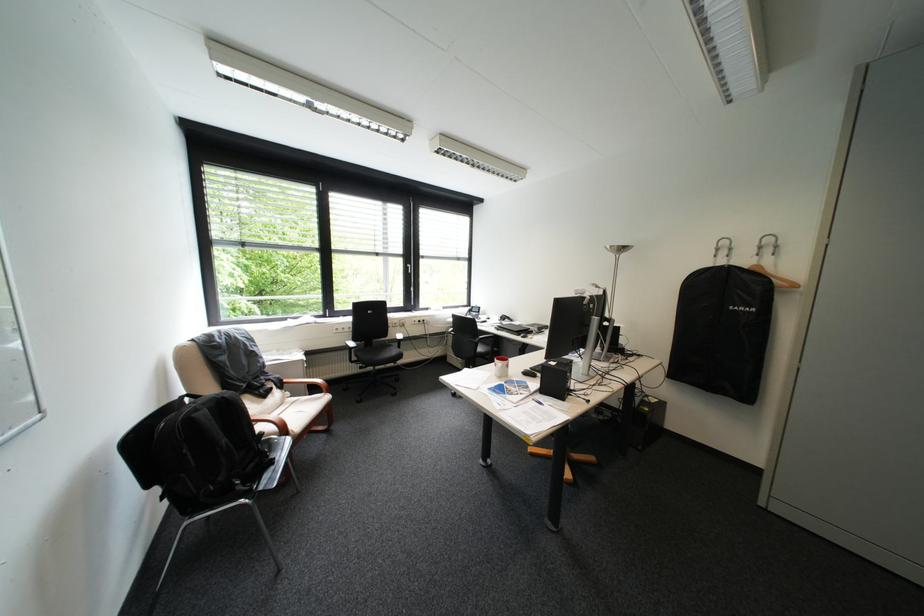
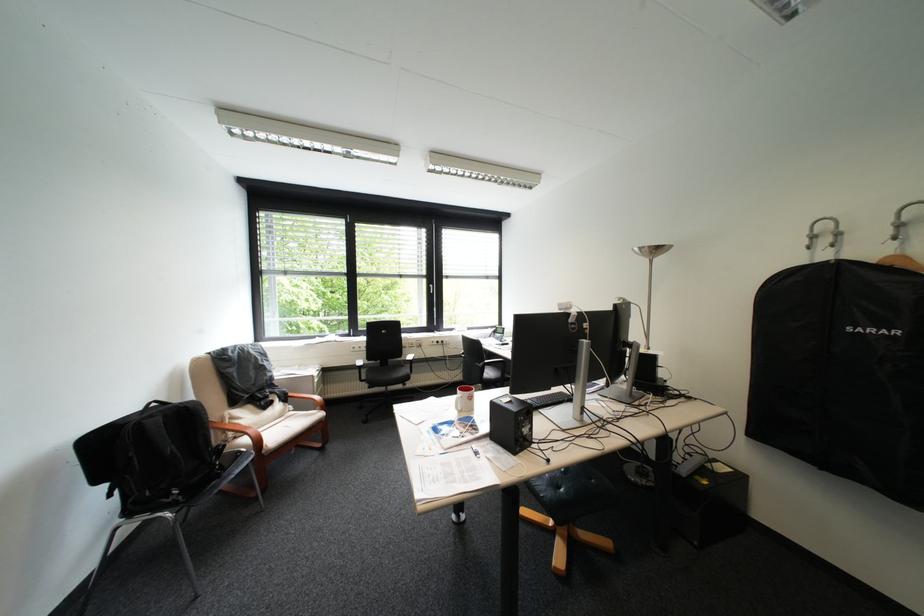
Locate, in the second image, the point that corresponds to [759,268] in the first image.

(886, 262)